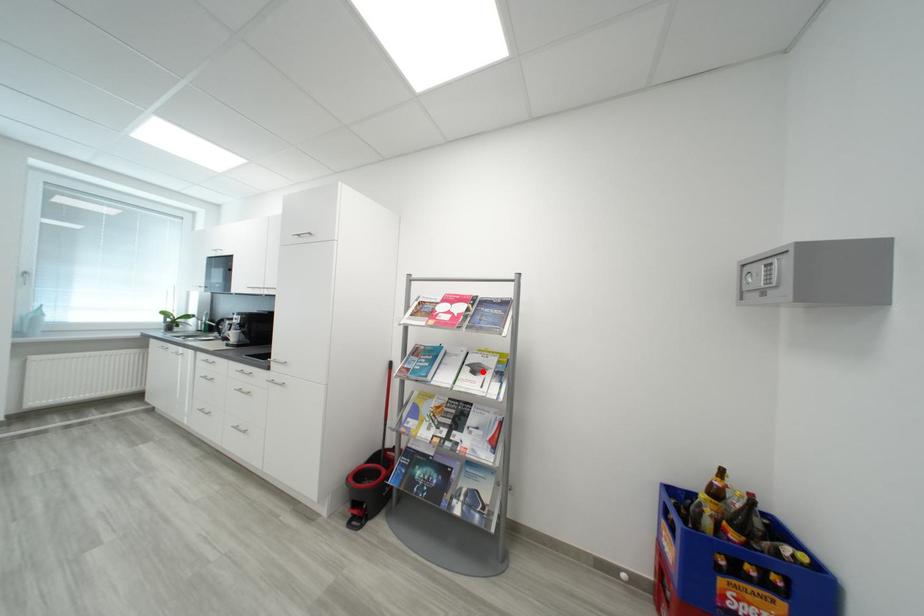
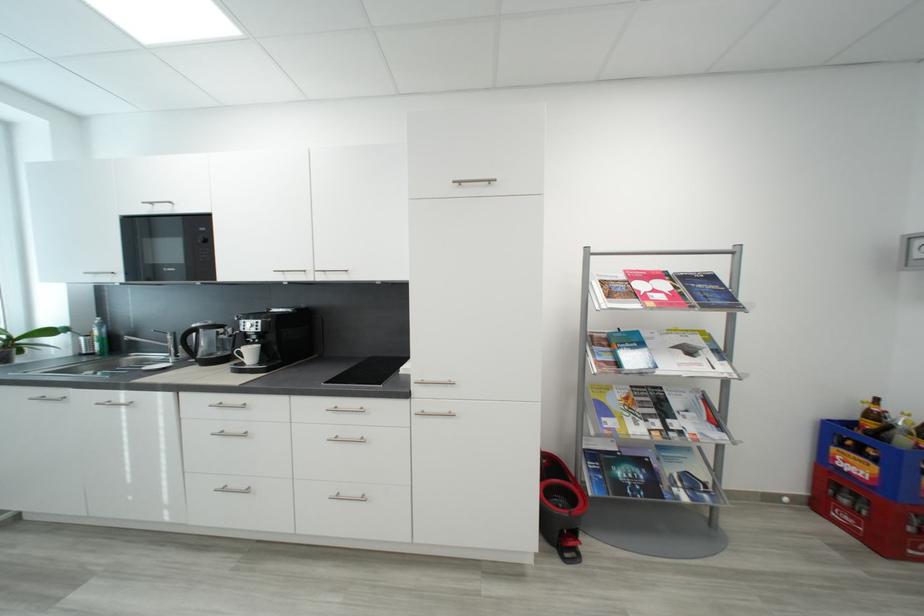
Question: I am providing you with two images of the same scene from different viewpoints. A red point is marked on the first image. Is the red point's position out of view in image 2?

Choices:
 (A) Yes
 (B) No

Answer: (B)